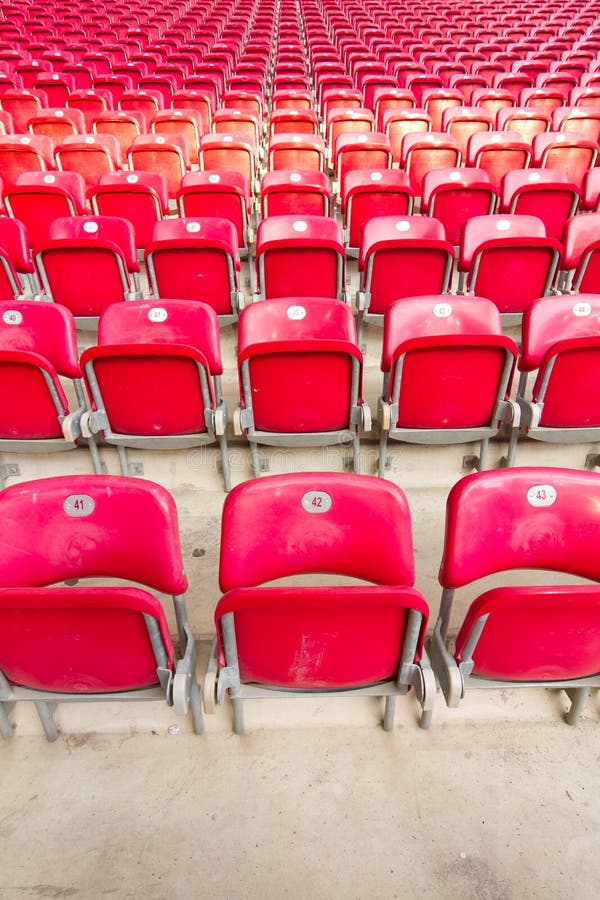
Where is `front 2 rows of seats`? This screenshot has width=600, height=900. front 2 rows of seats is located at coordinates (39, 335), (163, 333), (279, 333), (412, 330), (568, 324), (112, 544), (313, 549), (514, 546).